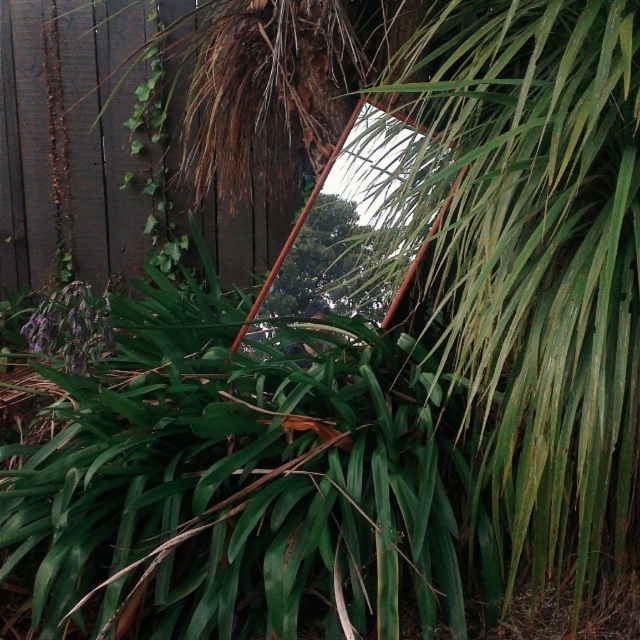
Is green leafy tree at center bigger than purple matte flower at lower left?

Correct, green leafy tree at center is larger in size than purple matte flower at lower left.

Who is positioned more to the right, green leafy tree at center or purple matte flower at lower left?

green leafy tree at center

Locate an element on the screen. This screenshot has width=640, height=640. green leafy tree at center is located at coordinates (326, 268).

The image size is (640, 640). I want to click on green leafy tree at center, so click(326, 268).